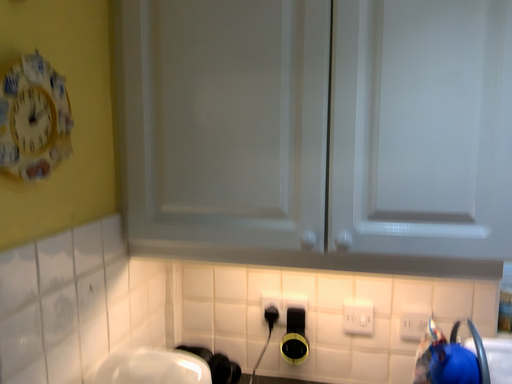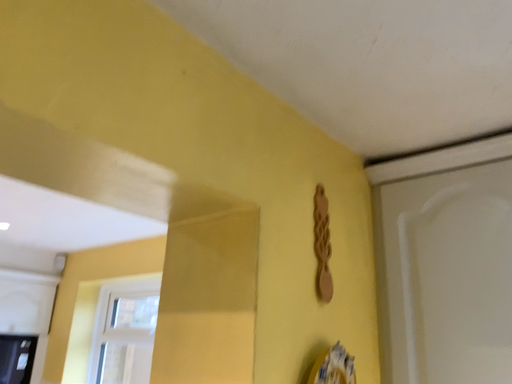
Question: How did the camera likely rotate when shooting the video?

Choices:
 (A) rotated left
 (B) rotated right

Answer: (A)